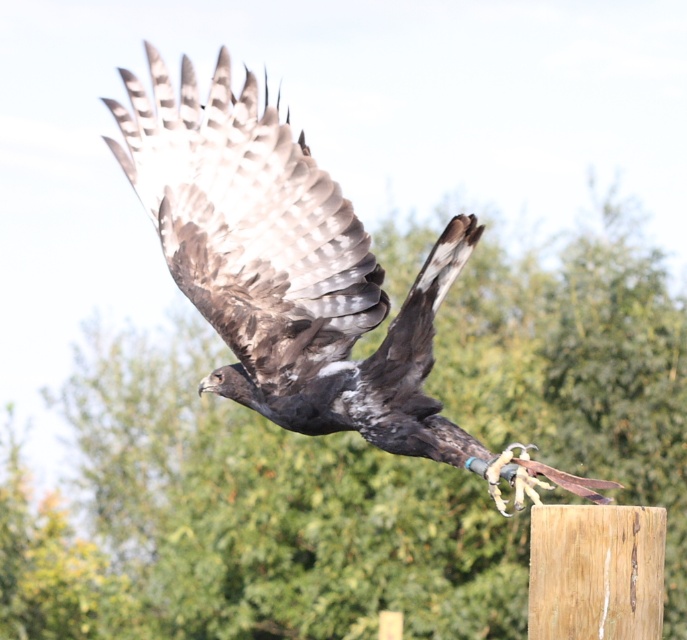
You are a falconer observing the bird of prey in flight. You notice a specific point marked at coordinates (295, 275). What is located at that point?

The point at coordinates (295, 275) marks the location of the dark brown feathers at center.

You are a nature photographer aiming to capture a clear shot of the wooden post at center and the green leafy tree at upper center. Based on their positions, which object should you focus on first to ensure both are in focus?

The wooden post at center is behind green leafy tree at upper center, so you should focus on the green leafy tree at upper center first since it is closer to you and the wooden post will be in focus as well due to its position behind.